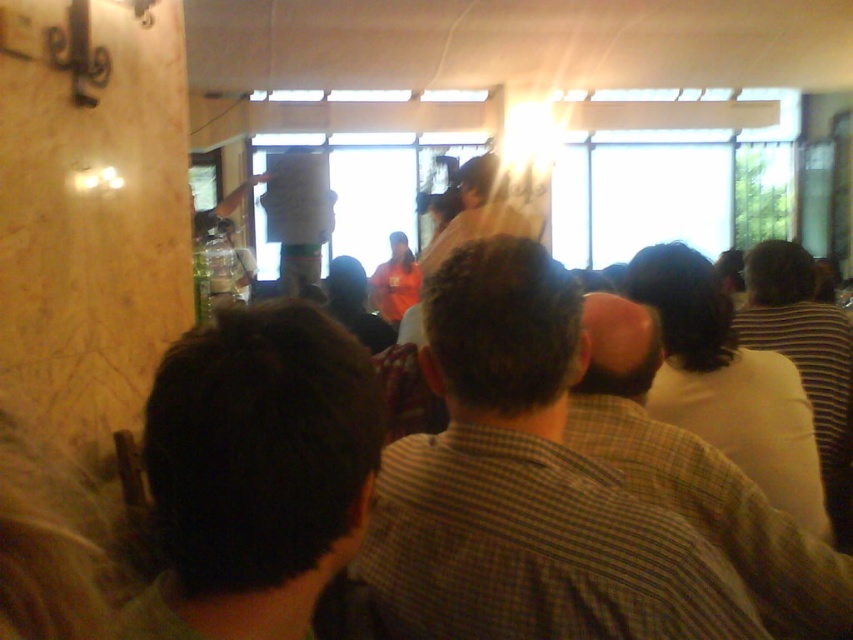
You are sitting at the back of the room and want to see the presenter better. Which of the two people in the center, the checkered shirt at center or the white shirt at center, is shorter so you can look past them?

The checkered shirt at center is shorter than the white shirt at center, so you can look past the checkered shirt at center to see the presenter better.